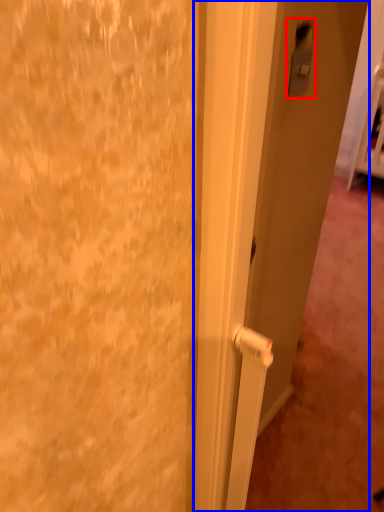
Question: Which object appears farthest to the camera in this image, light switch (highlighted by a red box) or door (highlighted by a blue box)?

Choices:
 (A) light switch
 (B) door

Answer: (A)